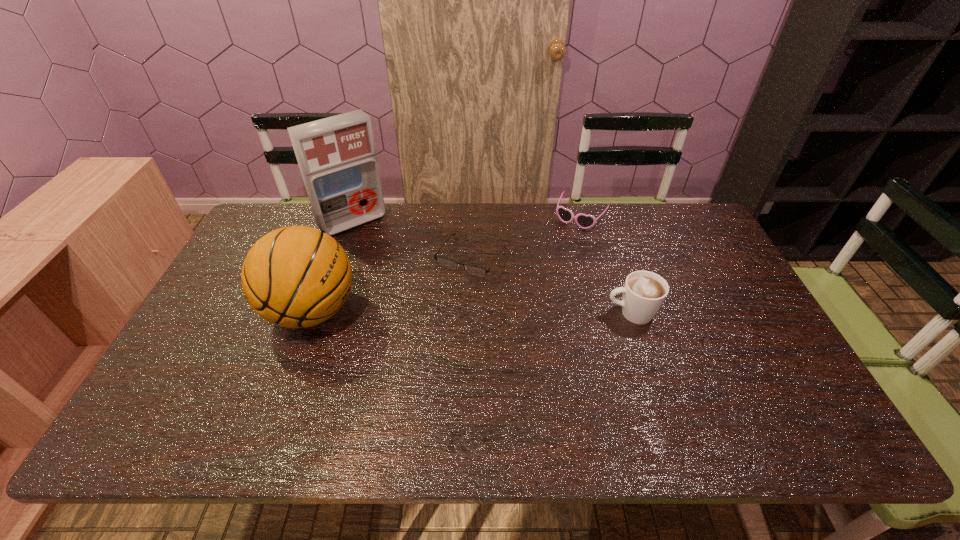
Locate an element on the screen. free space on the desktop that is between the basketball and the cappuccino and is positioned on the front-facing side of the shortest object is located at coordinates (437, 312).

Image resolution: width=960 pixels, height=540 pixels. Identify the location of vacant space on the desktop that is between the basketball and the cappuccino and is positioned on the front-facing side of the sunglasses. (516, 312).

The height and width of the screenshot is (540, 960). In order to click on free space on the desktop that is between the basketball and the cappuccino and is positioned on the front-facing side of the tallest object in this screenshot , I will do `click(426, 312)`.